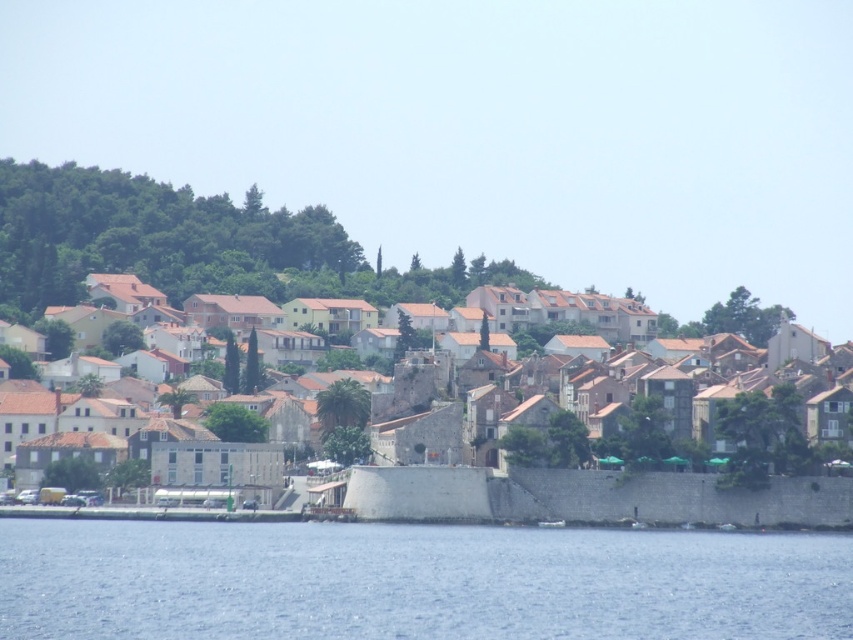
You are a photographer planning to capture the coastal town and its surroundings. You want to ensure that both the blue water at lower center and the brown stone town at center are clearly visible in your shot. Given their sizes, which object should you prioritize framing closer to avoid it appearing too small in the photo?

The blue water at lower center is smaller in size compared to the brown stone town at center. To ensure it doesn not appear too small, you should prioritize framing the blue water at lower center closer to the camera.

You are standing at the edge of the blue water at lower center and want to reach the brown stone town at center. Which direction should you move to get closer to the town?

You should move backward or away from the current position since the blue water at lower center is in front of the brown stone town at center, meaning the town is behind the water from your viewpoint.